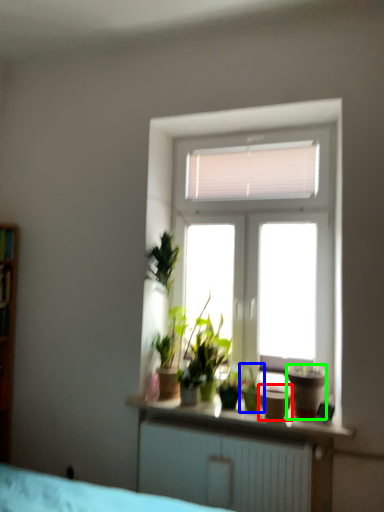
Question: Which object is the farthest from flowerpot (highlighted by a red box)? Choose among these: houseplant (highlighted by a blue box) or flowerpot (highlighted by a green box).

Choices:
 (A) houseplant
 (B) flowerpot

Answer: (B)